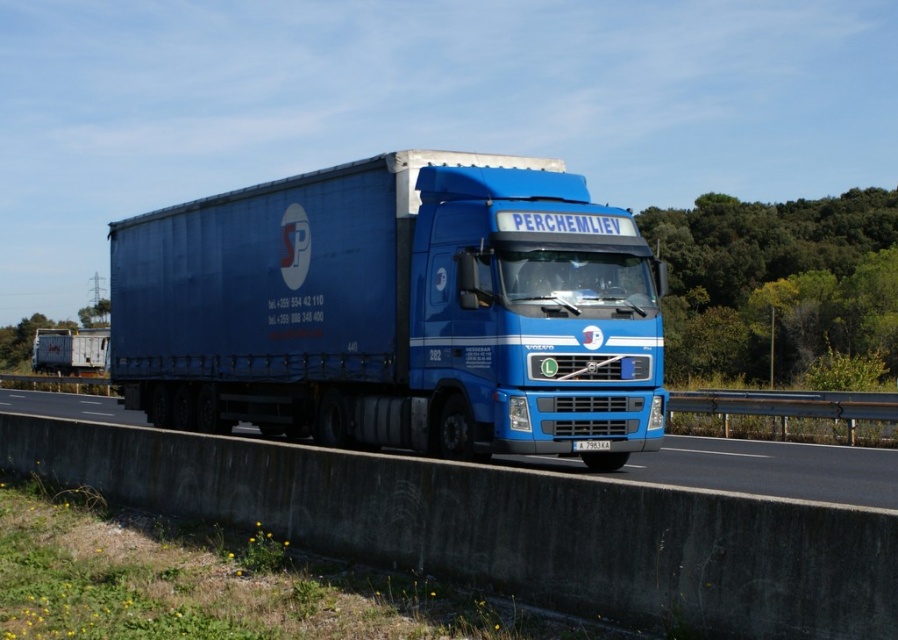
Does blue matte trailer truck at center have a greater height compared to blue metallic truck at center?

Yes.

Who is more distant from viewer, (649, 273) or (7, 390)?

Point (7, 390)

Describe the element at coordinates (398, 310) in the screenshot. This screenshot has width=898, height=640. I see `blue matte trailer truck at center` at that location.

Where is `blue matte trailer truck at center`? blue matte trailer truck at center is located at coordinates (398, 310).